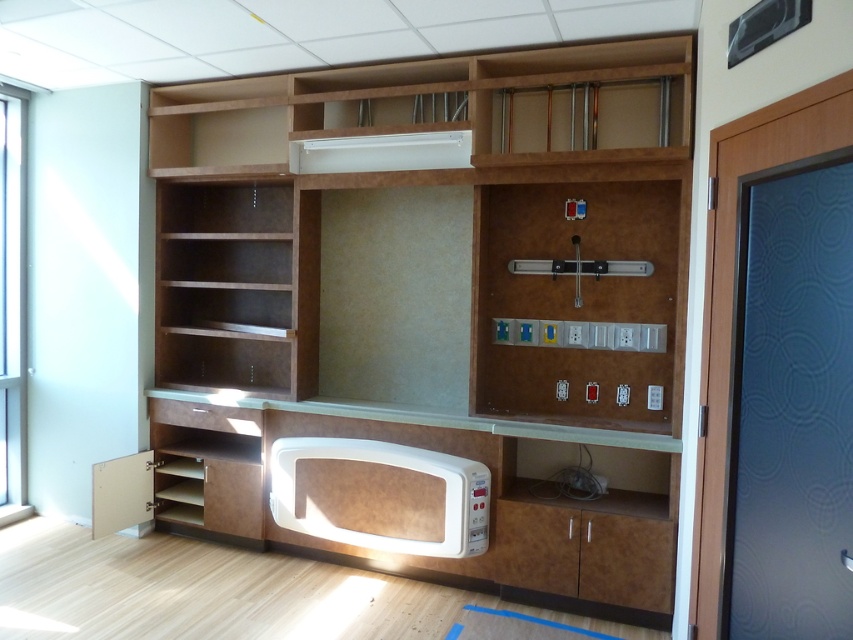
You are moving a 70 cm wide TV stand into the space between the burlwood cabinet at center and the white matte microwave at lower center. Based on the available space, will the TV stand fit?

The distance between the burlwood cabinet at center and the white matte microwave at lower center is 80.73 centimeters. Since the TV stand is 70 cm wide, it will fit within the space as 70 cm is less than 80.73 cm.

You are standing in front of the entertainment unit and want to place a small decorative item on the closest point between the two points, point (437, 540) and point (492, 346). Which point should you choose?

Point (437, 540) is closer to the camera than point (492, 346), so you should place the decorative item on point (437, 540).